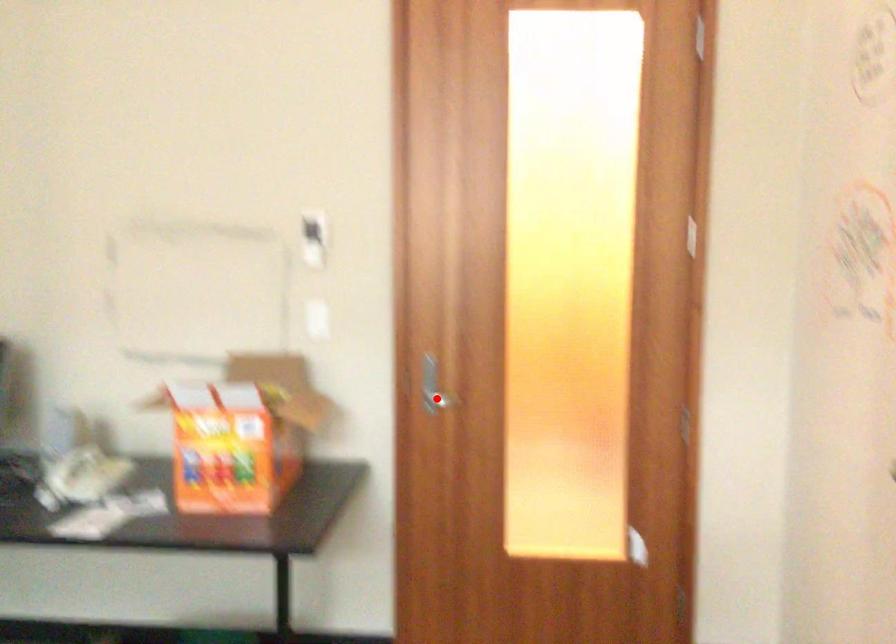
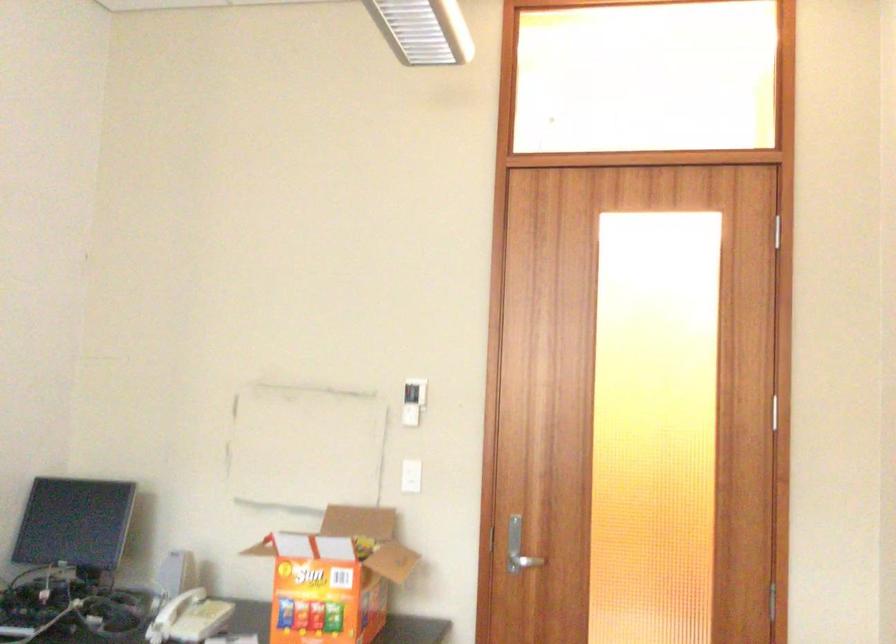
The point at the highlighted location is marked in the first image. Where is the corresponding point in the second image?

(523, 562)